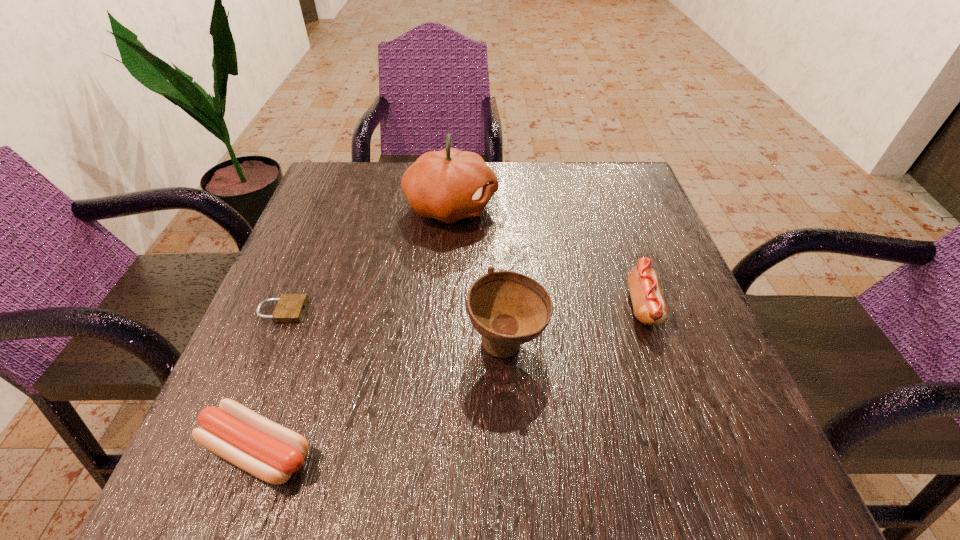
Locate an element on the screen. Image resolution: width=960 pixels, height=540 pixels. free point between the right sausage and the nearer sausage is located at coordinates (450, 377).

I want to click on vacant space that's between the right sausage and the tallest object, so click(547, 256).

Identify the location of empty location between the pumpkin and the soup bowl. (479, 275).

I want to click on vacant space in between the shortest object and the right sausage, so click(462, 308).

Locate an element on the screen. The width and height of the screenshot is (960, 540). free point between the soup bowl and the nearer sausage is located at coordinates pos(383,397).

Image resolution: width=960 pixels, height=540 pixels. Find the location of `vacant area between the soup bowl and the rightmost object`. vacant area between the soup bowl and the rightmost object is located at coordinates (575, 324).

Find the location of a particular element. unoccupied position between the nearest object and the padlock is located at coordinates (270, 381).

Where is `object that stands as the closest to the shortest object`? This screenshot has width=960, height=540. object that stands as the closest to the shortest object is located at coordinates (259, 446).

This screenshot has width=960, height=540. Identify the location of the third closest object to the farther sausage. (259, 446).

Image resolution: width=960 pixels, height=540 pixels. I want to click on vacant region that satisfies the following two spatial constraints: 1. on the keyhole side of the soup bowl; 2. on the right side of the padlock, so click(269, 343).